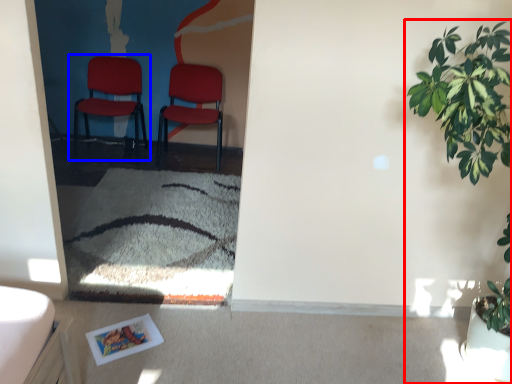
Question: Which object is further to the camera taking this photo, houseplant (highlighted by a red box) or chair (highlighted by a blue box)?

Choices:
 (A) houseplant
 (B) chair

Answer: (B)